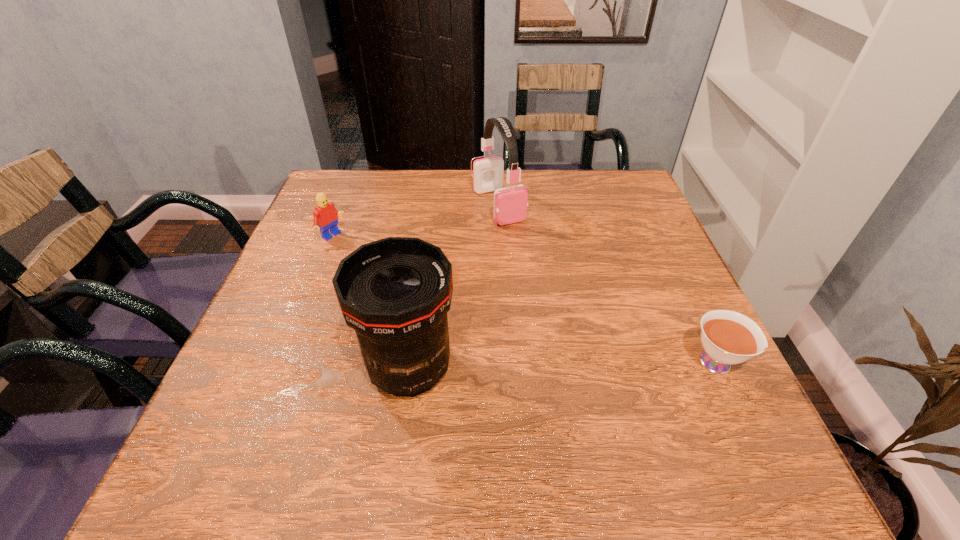
Where is `free space at the far edge of the desktop`? This screenshot has width=960, height=540. free space at the far edge of the desktop is located at coordinates (547, 198).

Find the location of a particular element. The height and width of the screenshot is (540, 960). vacant space at the near edge is located at coordinates (503, 406).

At what (x,y) coordinates should I click in order to perform the action: click on vacant space at the left edge. Please return your answer as a coordinate pair (x, y). Image resolution: width=960 pixels, height=540 pixels. Looking at the image, I should click on (321, 235).

Identify the location of free space at the right edge of the desktop. (634, 258).

Where is `free region at the far left corner`? The width and height of the screenshot is (960, 540). free region at the far left corner is located at coordinates (313, 202).

In the image, there is a desktop. Where is `vacant area at the near left corner`? vacant area at the near left corner is located at coordinates (242, 387).

Where is `vacant space at the far right corner of the desktop`? This screenshot has height=540, width=960. vacant space at the far right corner of the desktop is located at coordinates (609, 188).

Locate an element on the screen. This screenshot has height=540, width=960. free spot between the third object from left to right and the teacup is located at coordinates (609, 284).

Identify the location of vacant area that lies between the second shortest object and the shortest object. The width and height of the screenshot is (960, 540). (526, 300).

Where is `vacant area between the teacup and the farthest object`? vacant area between the teacup and the farthest object is located at coordinates (609, 284).